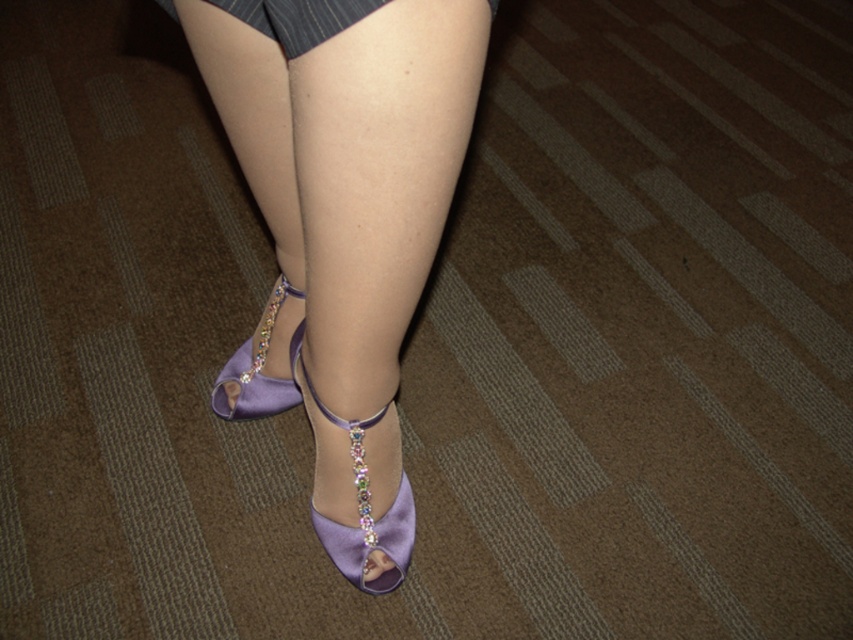
Question: Which object is closer to the camera taking this photo?

Choices:
 (A) satin purple high-heeled shoe at center
 (B) satin purple high-heeled shoe at lower center

Answer: (A)

Question: Can you confirm if satin purple high-heeled shoe at center is positioned above satin purple high-heeled shoe at lower center?

Choices:
 (A) no
 (B) yes

Answer: (B)

Question: Which is nearer to the satin purple high-heeled shoe at lower center?

Choices:
 (A) satin purple sandal at lower center
 (B) satin purple high-heeled shoe at center
 (C) dark gray textured fabric dress at upper center

Answer: (B)

Question: Based on their relative distances, which object is farther from the satin purple high-heeled shoe at center?

Choices:
 (A) dark gray textured fabric dress at upper center
 (B) satin purple sandal at lower center
 (C) satin purple high-heeled shoe at lower center

Answer: (A)

Question: From the image, what is the correct spatial relationship of satin purple sandal at lower center in relation to satin purple high-heeled shoe at lower center?

Choices:
 (A) above
 (B) below

Answer: (B)

Question: Does satin purple high-heeled shoe at center have a lesser width compared to dark gray textured fabric dress at upper center?

Choices:
 (A) no
 (B) yes

Answer: (A)